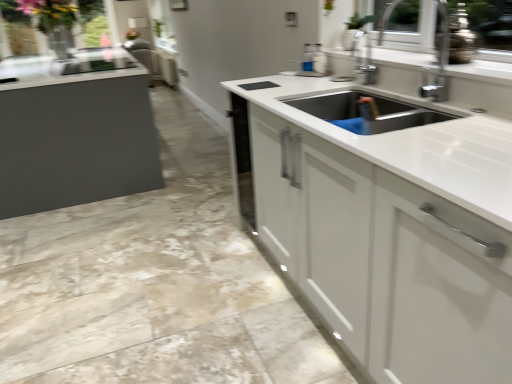
Question: From a real-world perspective, is white glossy countertop at center located higher than transparent glass window screen at upper left?

Choices:
 (A) no
 (B) yes

Answer: (A)

Question: Does white glossy countertop at center have a lesser width compared to transparent glass window screen at upper left?

Choices:
 (A) yes
 (B) no

Answer: (B)

Question: Is white glossy countertop at center smaller than transparent glass window screen at upper left?

Choices:
 (A) yes
 (B) no

Answer: (B)

Question: Is white glossy countertop at center outside transparent glass window screen at upper left?

Choices:
 (A) yes
 (B) no

Answer: (A)

Question: Can transparent glass window screen at upper left be found inside white glossy countertop at center?

Choices:
 (A) yes
 (B) no

Answer: (B)

Question: Considering the relative positions of white glossy countertop at center and transparent glass window screen at upper left in the image provided, is white glossy countertop at center to the right of transparent glass window screen at upper left from the viewer's perspective?

Choices:
 (A) no
 (B) yes

Answer: (B)

Question: Is transparent glass window screen at upper left positioned with its back to white glossy countertop at center?

Choices:
 (A) no
 (B) yes

Answer: (A)

Question: Could white glossy countertop at center be considered to be inside transparent glass window screen at upper left?

Choices:
 (A) no
 (B) yes

Answer: (A)

Question: Can you confirm if transparent glass window screen at upper left is taller than white glossy countertop at center?

Choices:
 (A) no
 (B) yes

Answer: (B)

Question: Can you confirm if transparent glass window screen at upper left is smaller than white glossy countertop at center?

Choices:
 (A) yes
 (B) no

Answer: (A)

Question: Can you confirm if transparent glass window screen at upper left is positioned to the right of white glossy countertop at center?

Choices:
 (A) yes
 (B) no

Answer: (B)

Question: Considering the relative sizes of transparent glass window screen at upper left and white glossy countertop at center in the image provided, is transparent glass window screen at upper left bigger than white glossy countertop at center?

Choices:
 (A) yes
 (B) no

Answer: (B)

Question: Would you say transparent glass window screen at upper left is inside or outside white glossy countertop at center?

Choices:
 (A) outside
 (B) inside

Answer: (A)